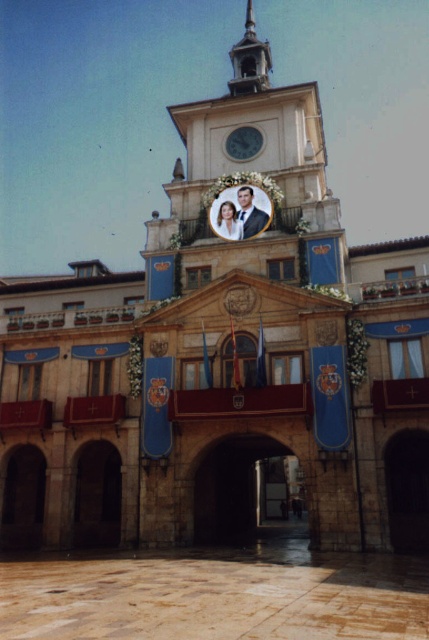
You are an architect assessing the building for maintenance. You need to determine which object, the polished wood spire at upper center or the metallic clock face at center, requires more frequent inspections due to its height. Based on the scene, which one should you prioritize?

The polished wood spire at upper center is taller than the metallic clock face at center, so it should be prioritized for more frequent inspections due to its greater height.

You are standing in front of the historic building and looking at its facade. There are two points marked on the building. The first point is at coordinates point (x=230, y=49) and the second point is at point (x=262, y=141). Which point is closer to you?

Point (x=230, y=49) is further to the camera than point (x=262, y=141), so the point closer to you is point (x=262, y=141).